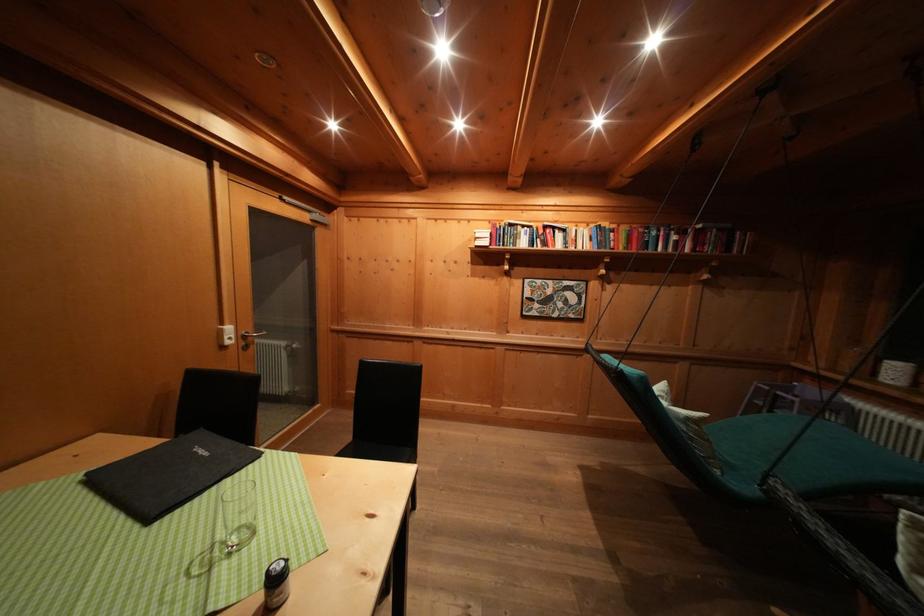
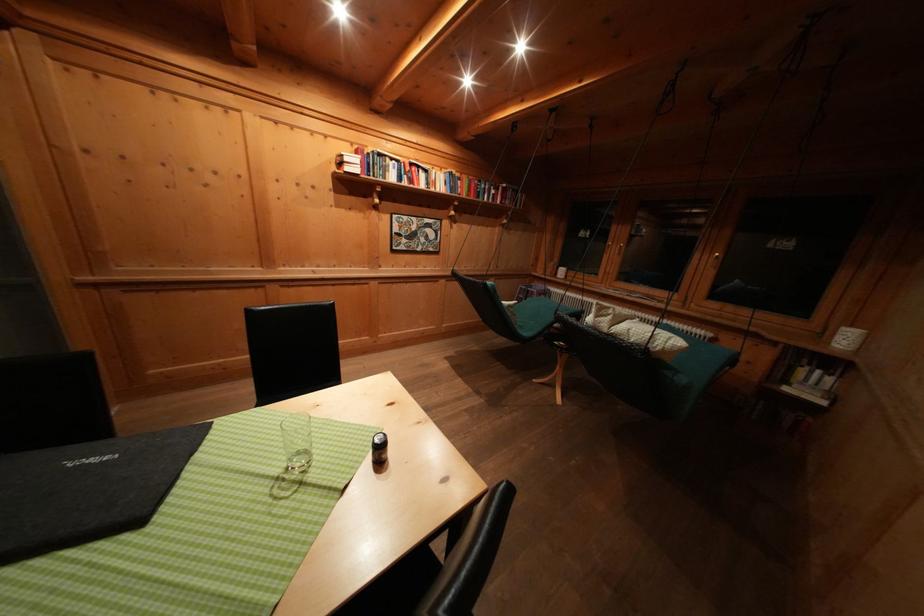
The point at (709, 424) is marked in the first image. Where is the corresponding point in the second image?

(520, 309)